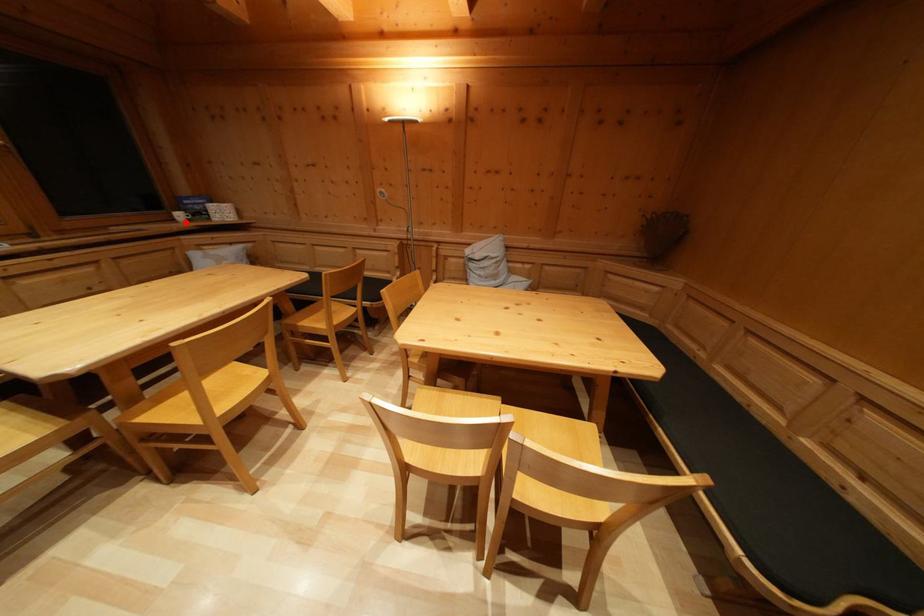
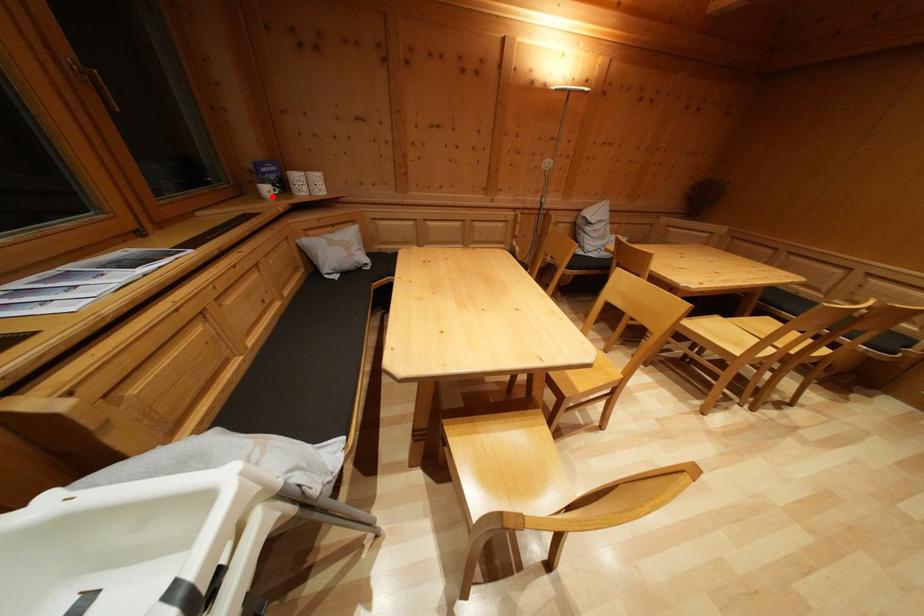
I am providing you with two images of the same scene from different viewpoints. A red point is marked on the first image and another point is marked on the second image. Does the point marked in image1 correspond to the same location as the one in image2?

Yes